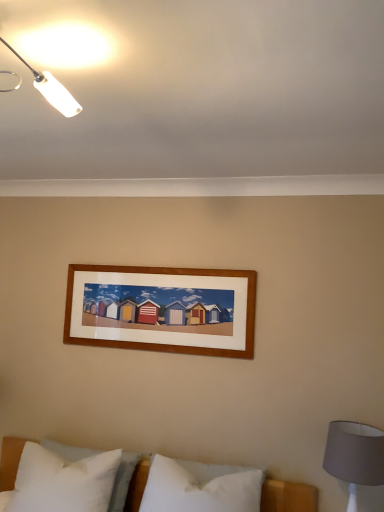
This screenshot has width=384, height=512. Describe the element at coordinates (354, 456) in the screenshot. I see `gray fabric lampshade at lower right` at that location.

Locate an element on the screen. The image size is (384, 512). white soft pillow at center, arranged as the second pillow when viewed from the left is located at coordinates (199, 489).

In order to face white plastic lamp at upper left, should I rotate leftwards or rightwards?

To face it directly, rotate left by 24.411 degrees.

The image size is (384, 512). I want to click on white soft pillow at lower left, which is the 2th pillow from right to left, so 67,483.

Find the location of `gray fabric lampshade at lower right`. gray fabric lampshade at lower right is located at coordinates (354, 456).

From a real-world perspective, who is located higher, white plastic lamp at upper left or gray fabric lampshade at lower right?

In real-world perspective, white plastic lamp at upper left is above.

The image size is (384, 512). I want to click on lamp above the gray fabric lampshade at lower right (from the image's perspective), so click(51, 89).

From the image's perspective, which one is positioned higher, white plastic lamp at upper left or gray fabric lampshade at lower right?

white plastic lamp at upper left, from the image's perspective.

Considering the relative sizes of white plastic lamp at upper left and gray fabric lampshade at lower right in the image provided, is white plastic lamp at upper left shorter than gray fabric lampshade at lower right?

Indeed, white plastic lamp at upper left has a lesser height compared to gray fabric lampshade at lower right.

Is white soft pillow at lower left, arranged as the 1th pillow when viewed from the left, not inside white soft pillow at center, which is the 1th pillow from right to left?

Yes.

Is white soft pillow at lower left, which is the 2th pillow from right to left, closer to the viewer compared to white soft pillow at center, arranged as the second pillow when viewed from the left?

Yes, it is.

Which of these two, white soft pillow at lower left, arranged as the 1th pillow when viewed from the left, or white soft pillow at center, arranged as the second pillow when viewed from the left, is wider?

white soft pillow at lower left, arranged as the 1th pillow when viewed from the left, is wider.

Measure the distance between white soft pillow at lower left, arranged as the 1th pillow when viewed from the left, and white soft pillow at center, arranged as the second pillow when viewed from the left.

15.93 inches.

From a real-world perspective, is white plastic lamp at upper left positioned over white soft pillow at lower left, arranged as the 1th pillow when viewed from the left, based on gravity?

Yes.

Can you confirm if white plastic lamp at upper left is positioned to the left of white soft pillow at lower left, arranged as the 1th pillow when viewed from the left?

In fact, white plastic lamp at upper left is to the right of white soft pillow at lower left, arranged as the 1th pillow when viewed from the left.

How far apart are white plastic lamp at upper left and white soft pillow at lower left, which is the 2th pillow from right to left?

white plastic lamp at upper left is 5.51 feet from white soft pillow at lower left, which is the 2th pillow from right to left.

Which object is closer to the camera taking this photo, gray fabric lampshade at lower right or white plastic lamp at upper left?

white plastic lamp at upper left.

Is gray fabric lampshade at lower right facing away from white plastic lamp at upper left?

gray fabric lampshade at lower right does not have its back to white plastic lamp at upper left.

Which is more to the left, gray fabric lampshade at lower right or white plastic lamp at upper left?

Positioned to the left is white plastic lamp at upper left.

In the scene shown: Looking at their sizes, would you say gray fabric lampshade at lower right is wider or thinner than white plastic lamp at upper left?

Clearly, gray fabric lampshade at lower right has more width compared to white plastic lamp at upper left.

Is gray fabric lampshade at lower right facing away from white soft pillow at center, which is the 1th pillow from right to left?

gray fabric lampshade at lower right does not have its back to white soft pillow at center, which is the 1th pillow from right to left.

In the image, is gray fabric lampshade at lower right on the left side or the right side of white soft pillow at center, arranged as the second pillow when viewed from the left?

From the image, it's evident that gray fabric lampshade at lower right is to the right of white soft pillow at center, arranged as the second pillow when viewed from the left.

Based on the photo, between gray fabric lampshade at lower right and white soft pillow at center, which is the 1th pillow from right to left, which one has smaller size?

Smaller between the two is gray fabric lampshade at lower right.

Consider the image. Is gray fabric lampshade at lower right situated inside white soft pillow at center, arranged as the second pillow when viewed from the left, or outside?

gray fabric lampshade at lower right is not inside white soft pillow at center, arranged as the second pillow when viewed from the left, it's outside.

Looking at the image, does white plastic lamp at upper left seem bigger or smaller compared to white soft pillow at center, arranged as the second pillow when viewed from the left?

white plastic lamp at upper left is smaller than white soft pillow at center, arranged as the second pillow when viewed from the left.

How many degrees apart are the facing directions of white plastic lamp at upper left and white soft pillow at center, which is the 1th pillow from right to left?

88.7 degrees separate the facing orientations of white plastic lamp at upper left and white soft pillow at center, which is the 1th pillow from right to left.

In order to click on lamp that is above the white soft pillow at center, arranged as the second pillow when viewed from the left (from a real-world perspective) in this screenshot , I will do `click(51, 89)`.

Is white plastic lamp at upper left with white soft pillow at center, arranged as the second pillow when viewed from the left?

No, white plastic lamp at upper left is not in contact with white soft pillow at center, arranged as the second pillow when viewed from the left.

From a real-world perspective, which is physically above, white soft pillow at lower left, which is the 2th pillow from right to left, or gray fabric lampshade at lower right?

From a 3D spatial view, gray fabric lampshade at lower right is above.

Based on the photo, which object is further away from the camera taking this photo, white soft pillow at lower left, arranged as the 1th pillow when viewed from the left, or gray fabric lampshade at lower right?

white soft pillow at lower left, arranged as the 1th pillow when viewed from the left, is further away from the camera.

In terms of height, does white soft pillow at lower left, arranged as the 1th pillow when viewed from the left, look taller or shorter compared to gray fabric lampshade at lower right?

Considering their sizes, white soft pillow at lower left, arranged as the 1th pillow when viewed from the left, has less height than gray fabric lampshade at lower right.

Which object is positioned more to the right, white soft pillow at lower left, which is the 2th pillow from right to left, or gray fabric lampshade at lower right?

From the viewer's perspective, gray fabric lampshade at lower right appears more on the right side.

I want to click on lamp that appears above the gray fabric lampshade at lower right (from the image's perspective), so click(51, 89).

Find the location of `pillow below the white soft pillow at lower left, arranged as the 1th pillow when viewed from the left (from the image's perspective)`. pillow below the white soft pillow at lower left, arranged as the 1th pillow when viewed from the left (from the image's perspective) is located at coordinates (199, 489).

Considering their positions, is gray fabric lampshade at lower right positioned further to white soft pillow at lower left, arranged as the 1th pillow when viewed from the left, than white plastic lamp at upper left?

white plastic lamp at upper left is positioned further to the anchor white soft pillow at lower left, arranged as the 1th pillow when viewed from the left.

Which object lies further to the anchor point white plastic lamp at upper left, white soft pillow at lower left, arranged as the 1th pillow when viewed from the left, or white soft pillow at center, arranged as the second pillow when viewed from the left?

Based on the image, white soft pillow at center, arranged as the second pillow when viewed from the left, appears to be further to white plastic lamp at upper left.

Estimate the real-world distances between objects in this image. Which object is further from white soft pillow at lower left, which is the 2th pillow from right to left, gray fabric lampshade at lower right or white soft pillow at center, arranged as the second pillow when viewed from the left?

Among the two, gray fabric lampshade at lower right is located further to white soft pillow at lower left, which is the 2th pillow from right to left.

Consider the image. When comparing their distances from white plastic lamp at upper left, does gray fabric lampshade at lower right or white soft pillow at center, arranged as the second pillow when viewed from the left, seem closer?

Among the two, white soft pillow at center, arranged as the second pillow when viewed from the left, is located nearer to white plastic lamp at upper left.

Based on their spatial positions, is white soft pillow at lower left, arranged as the 1th pillow when viewed from the left, or white plastic lamp at upper left further from white soft pillow at center, which is the 1th pillow from right to left?

Among the two, white plastic lamp at upper left is located further to white soft pillow at center, which is the 1th pillow from right to left.

Estimate the real-world distances between objects in this image. Which object is closer to white soft pillow at center, which is the 1th pillow from right to left, gray fabric lampshade at lower right or white plastic lamp at upper left?

The object closer to white soft pillow at center, which is the 1th pillow from right to left, is gray fabric lampshade at lower right.

When comparing their distances from white soft pillow at center, which is the 1th pillow from right to left, does gray fabric lampshade at lower right or white soft pillow at lower left, arranged as the 1th pillow when viewed from the left, seem closer?

white soft pillow at lower left, arranged as the 1th pillow when viewed from the left.

Based on their spatial positions, is white plastic lamp at upper left or white soft pillow at center, which is the 1th pillow from right to left, further from white soft pillow at lower left, which is the 2th pillow from right to left?

white plastic lamp at upper left.

You are a GUI agent. You are given a task and a screenshot of the screen. Output one action in this format:
    pyautogui.click(x=<x>, y=<y>)
    Task: Click on the bedside lamp that lies between white plastic lamp at upper left and white soft pillow at center, which is the 1th pillow from right to left, from top to bottom
    Image resolution: width=384 pixels, height=512 pixels.
    Given the screenshot: What is the action you would take?
    pyautogui.click(x=354, y=456)

The width and height of the screenshot is (384, 512). I want to click on pillow situated between white soft pillow at lower left, which is the 2th pillow from right to left, and gray fabric lampshade at lower right from left to right, so click(199, 489).

I want to click on pillow between white plastic lamp at upper left and white soft pillow at center, which is the 1th pillow from right to left, in the vertical direction, so click(x=67, y=483).

This screenshot has height=512, width=384. I want to click on bedside lamp between white plastic lamp at upper left and white soft pillow at lower left, arranged as the 1th pillow when viewed from the left, in the up-down direction, so click(x=354, y=456).